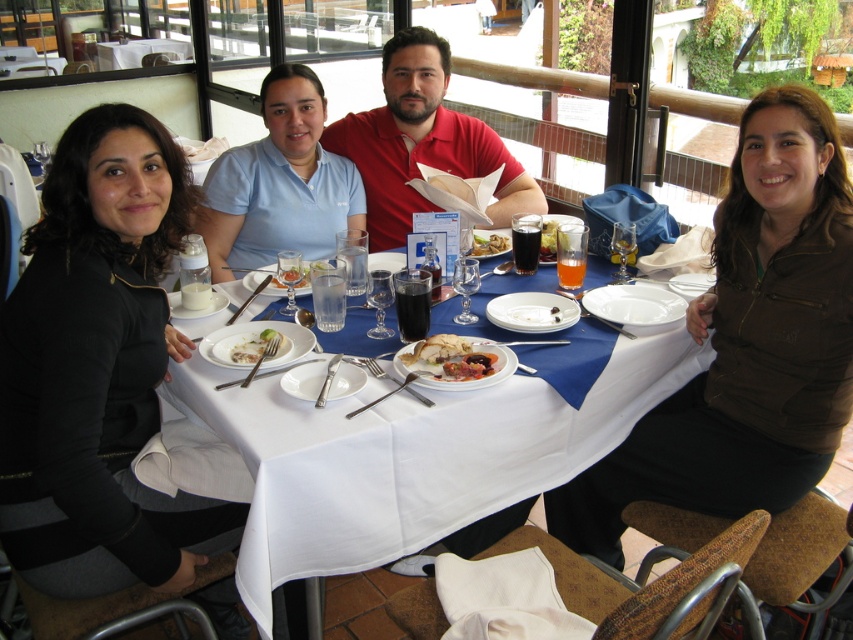
You are sitting at the dining table and want to hand a napkin to the person wearing the red matte shirt at center. Since the white cloth table at center is between you and them, will you have to move around it to reach them?

The white cloth table at center is in front of the red matte shirt at center, so you would need to move around the table to reach them as it is blocking the direct path.

You are sitting at the dining table in the restaurant scene. You notice two points marked on the tablecloth. The first point is at coordinates point (x=572, y=442) and the second is at point (x=393, y=211). If you were to move an item from the first point to the second, in which direction would you move it?

To move the item from point (x=572, y=442) to point (x=393, y=211), you would move it backward since point (x=572, y=442) is in front of point (x=393, y=211).

You are a waiter at a restaurant and need to deliver a drink to the table. The drink must be placed at the exact coordinates of point (99, 369). However, there is an object at that location. What is the object blocking the placement of the drink?

The object at point (99, 369) is the black matte jacket at left, so placing the drink there would require moving the jacket first.